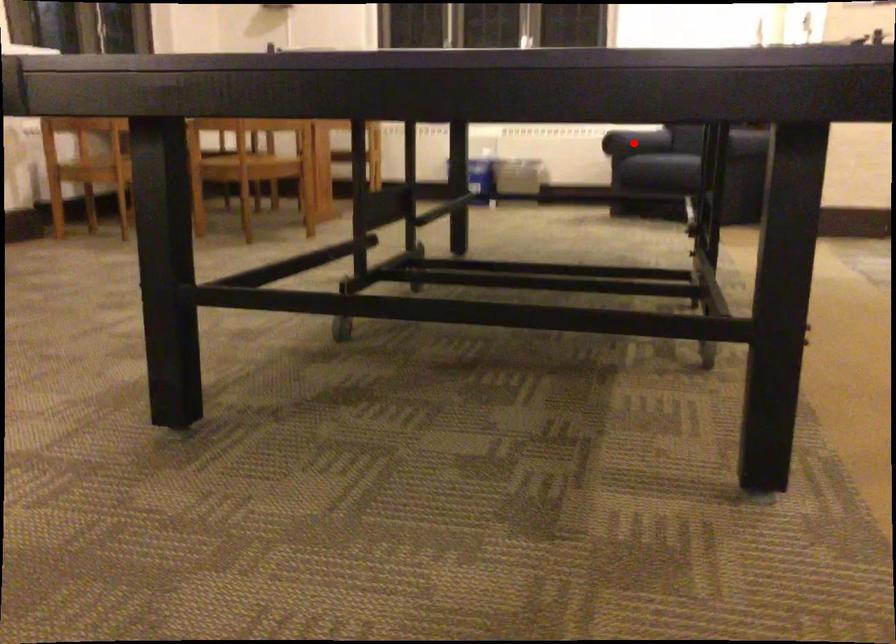
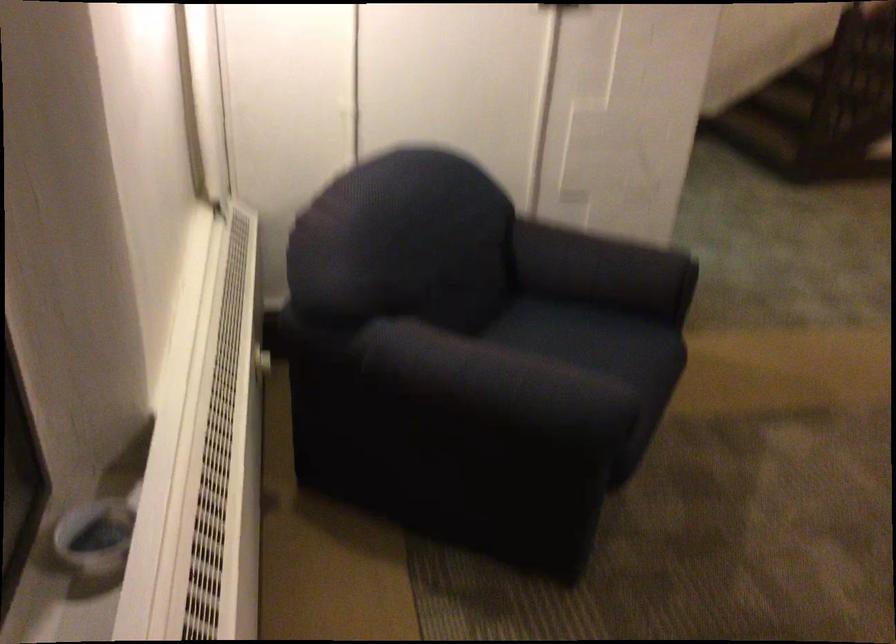
Question: I am providing you with two images of the same scene from different viewpoints. A red point is marked on the first image. At the location where the point appears in image 1, is it still visible in image 2?

Choices:
 (A) Yes
 (B) No

Answer: (B)